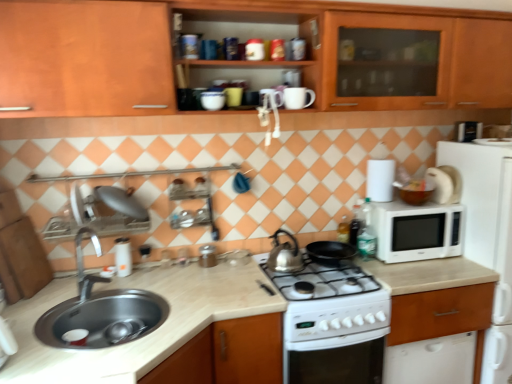
The height and width of the screenshot is (384, 512). What are the coordinates of `free spot behind silver metallic faucet at sink left` in the screenshot? It's located at (104, 284).